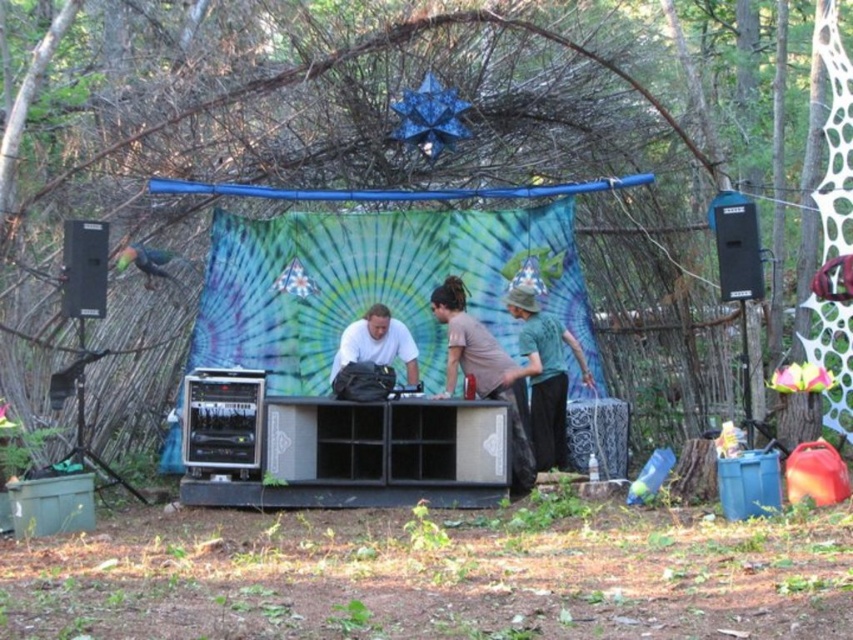
Is point (219, 320) closer to camera compared to point (373, 324)?

No, it is behind (373, 324).

Consider the image. Is tie-dye fabric tent at center closer to the viewer compared to white matte shirt at center?

That is False.

Locate an element on the screen. The height and width of the screenshot is (640, 853). tie-dye fabric tent at center is located at coordinates pyautogui.click(x=372, y=284).

Between tie-dye fabric tent at center and green cotton shirt at center, which one has less height?

green cotton shirt at center

The height and width of the screenshot is (640, 853). I want to click on tie-dye fabric tent at center, so coord(372,284).

Is point (260, 307) closer to camera compared to point (555, 385)?

That is False.

What are the coordinates of `tie-dye fabric tent at center` in the screenshot? It's located at (372, 284).

Does green cotton shirt at center have a greater width compared to white matte shirt at center?

Correct, the width of green cotton shirt at center exceeds that of white matte shirt at center.

Is green cotton shirt at center to the right of white matte shirt at center from the viewer's perspective?

Correct, you'll find green cotton shirt at center to the right of white matte shirt at center.

Describe the element at coordinates (544, 376) in the screenshot. I see `green cotton shirt at center` at that location.

What are the coordinates of `green cotton shirt at center` in the screenshot? It's located at (544, 376).